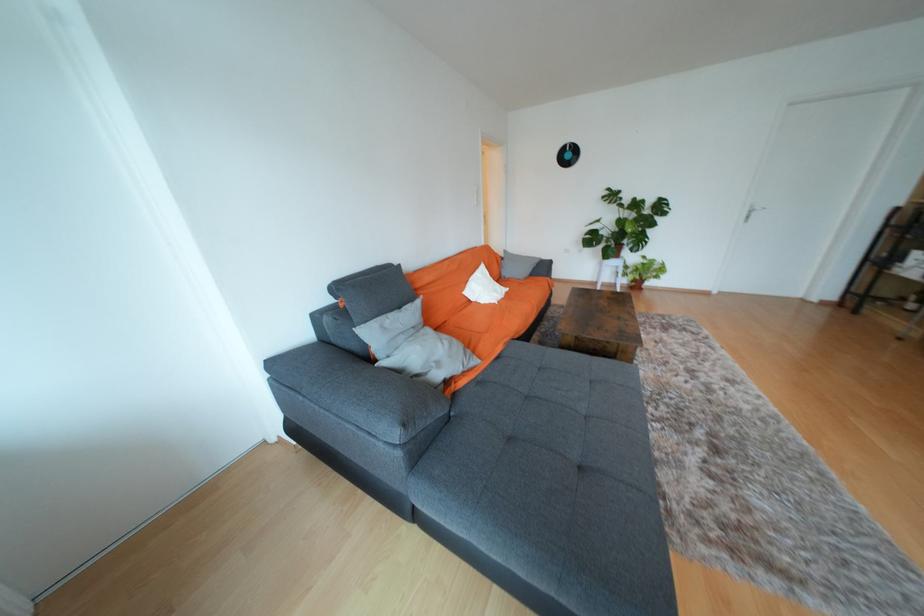
Where would you sit the sofa sitting surface? Please return your answer as a coordinate pair (x, y).

(560, 451)